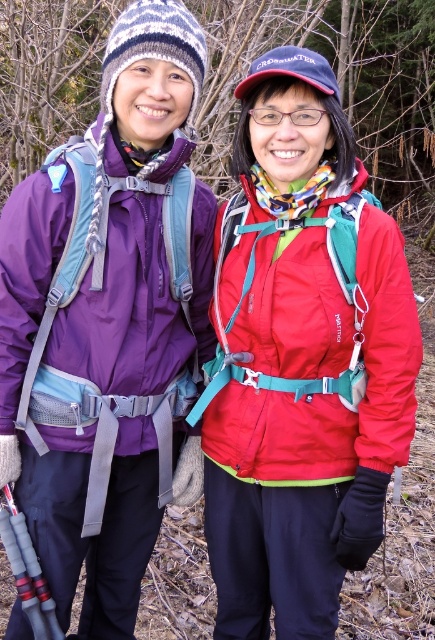
Question: Is matte purple jacket at left positioned in front of matte red jacket at center?

Choices:
 (A) yes
 (B) no

Answer: (B)

Question: Which point is closer to the camera?

Choices:
 (A) matte purple jacket at left
 (B) matte red jacket at center

Answer: (B)

Question: Among these points, which one is nearest to the camera?

Choices:
 (A) (273, 342)
 (B) (99, 381)

Answer: (B)

Question: Is matte purple jacket at left above matte red jacket at center?

Choices:
 (A) yes
 (B) no

Answer: (A)

Question: Does matte purple jacket at left appear under matte red jacket at center?

Choices:
 (A) yes
 (B) no

Answer: (B)